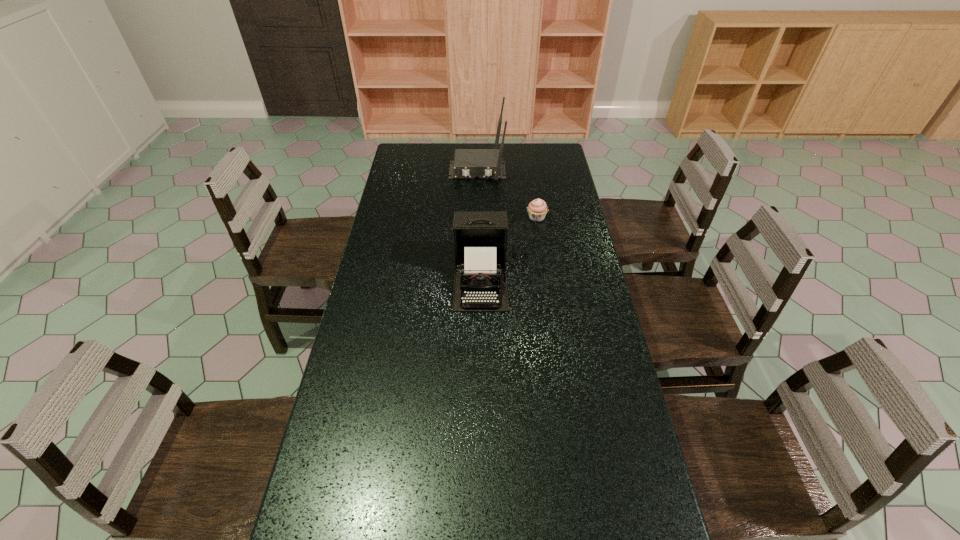
Identify the location of object that is positioned at the right edge. This screenshot has width=960, height=540. (537, 209).

You are a GUI agent. You are given a task and a screenshot of the screen. Output one action in this format:
    pyautogui.click(x=<x>, y=<y>)
    Task: Click on the vacant space at the far edge of the desktop
    The height and width of the screenshot is (540, 960).
    Given the screenshot: What is the action you would take?
    pyautogui.click(x=451, y=156)

Where is `free space at the left edge`? This screenshot has height=540, width=960. free space at the left edge is located at coordinates (339, 376).

Locate an element on the screen. This screenshot has width=960, height=540. vacant region at the right edge of the desktop is located at coordinates (588, 476).

Identify the location of free space that is in between the tallest object and the cupcake. This screenshot has height=540, width=960. (507, 194).

Locate an element on the screen. Image resolution: width=960 pixels, height=540 pixels. free spot between the second tallest object and the second nearest object is located at coordinates (509, 249).

Locate an element on the screen. The image size is (960, 540). free spot between the cupcake and the tallest object is located at coordinates (507, 194).

Find the location of a particular element. This screenshot has width=960, height=540. blank region between the shortest object and the nearest object is located at coordinates (509, 249).

Find the location of `object that is the closest to the second tallest object`. object that is the closest to the second tallest object is located at coordinates coord(537,209).

Where is `object that ranks as the second closest to the router`? This screenshot has height=540, width=960. object that ranks as the second closest to the router is located at coordinates (480, 237).